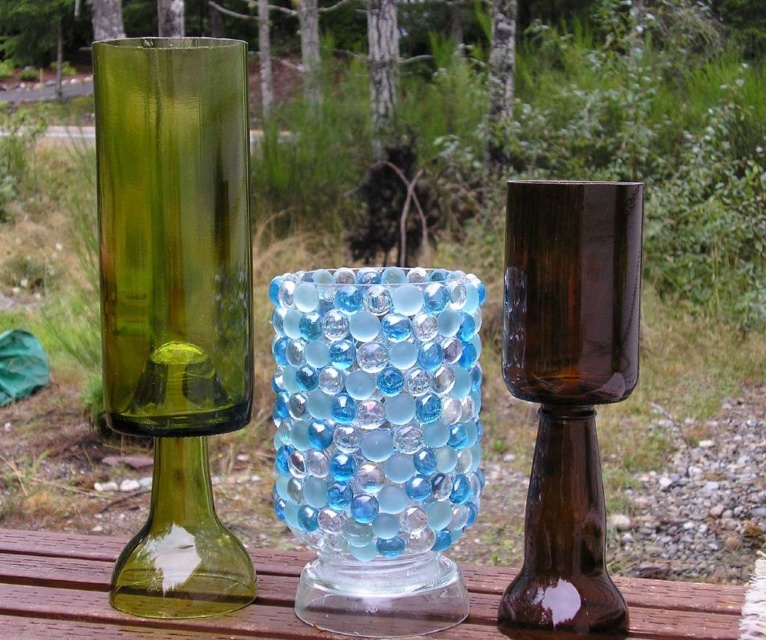
Question: Is green glass vase at left thinner than transparent glass table at center?

Choices:
 (A) no
 (B) yes

Answer: (B)

Question: Can you confirm if translucent blue glass vase at center is wider than brown glass goblet at center?

Choices:
 (A) no
 (B) yes

Answer: (B)

Question: Which object appears closest to the camera in this image?

Choices:
 (A) green glass vase at left
 (B) translucent blue glass vase at center
 (C) transparent glass table at center

Answer: (B)

Question: Which of the following is the farthest from the observer?

Choices:
 (A) (447, 378)
 (B) (87, 634)
 (C) (221, 227)
 (D) (584, 209)

Answer: (B)

Question: Based on their relative distances, which object is nearer to the translucent blue glass vase at center?

Choices:
 (A) green glass vase at left
 (B) brown glass goblet at center

Answer: (B)

Question: Does green glass vase at left have a lesser width compared to brown glass goblet at center?

Choices:
 (A) no
 (B) yes

Answer: (A)